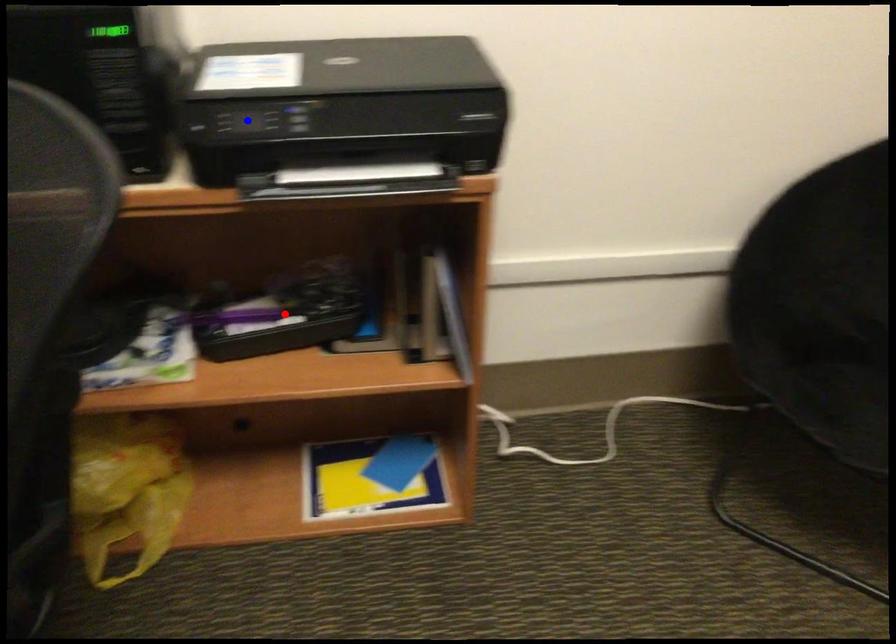
Question: In the image, two points are highlighted. Which point is nearer to the camera? Reply with the corresponding letter.

Choices:
 (A) blue point
 (B) red point

Answer: (A)